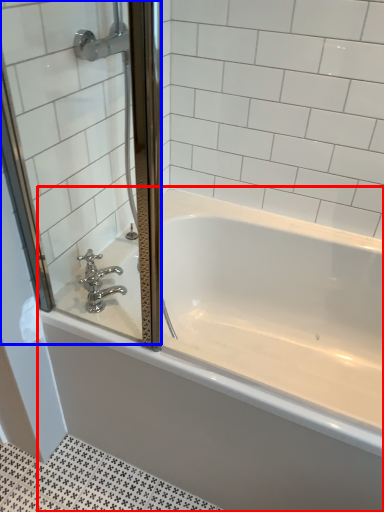
Question: Which point is further to the camera, bathtub (highlighted by a red box) or screen door (highlighted by a blue box)?

Choices:
 (A) bathtub
 (B) screen door

Answer: (A)